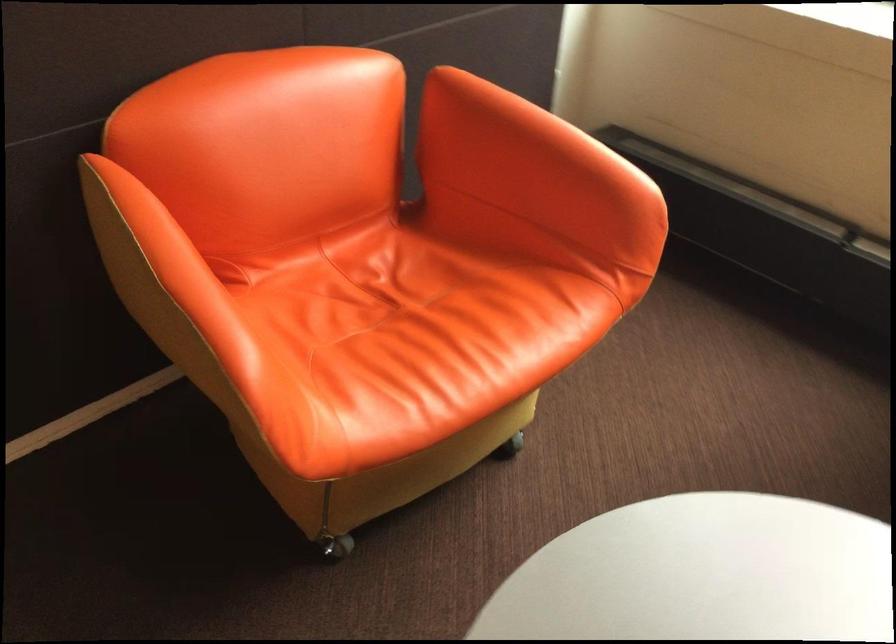
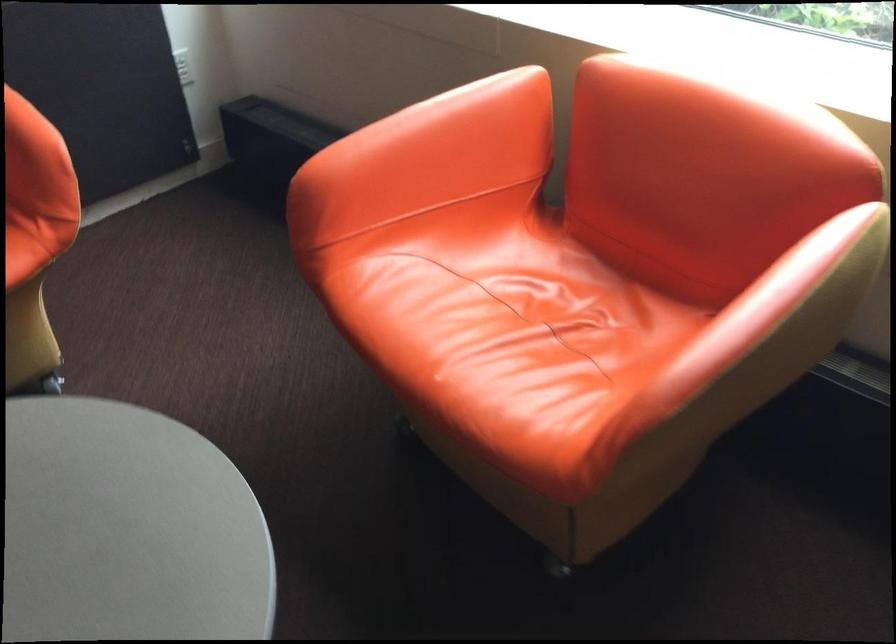
Question: Which direction would the cameraman need to move to produce the second image? Reply with the corresponding letter.

Choices:
 (A) Left
 (B) Right
 (C) Forward
 (D) Backward

Answer: (B)